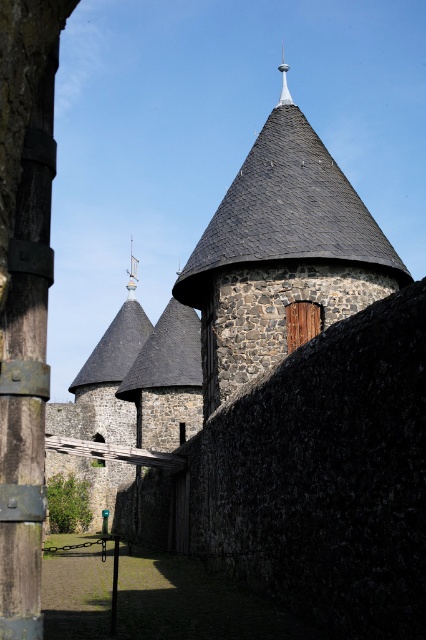
Question: From the image, what is the correct spatial relationship of dark gray stone tower at center in relation to silver metallic spire at upper center?

Choices:
 (A) left
 (B) right

Answer: (A)

Question: Observing the image, what is the correct spatial positioning of silver metallic spire at upper center in reference to shiny silver spire at center?

Choices:
 (A) right
 (B) left

Answer: (A)

Question: Which object appears farthest from the camera in this image?

Choices:
 (A) shiny silver spire at center
 (B) dark gray stone tower at center
 (C) silver metallic spire at upper center

Answer: (A)

Question: Does dark gray stone tower at center have a lesser width compared to silver metallic spire at upper center?

Choices:
 (A) yes
 (B) no

Answer: (A)

Question: Which of the following is the farthest from the observer?

Choices:
 (A) (307, 269)
 (B) (132, 262)

Answer: (B)

Question: Which object is closer to the camera taking this photo?

Choices:
 (A) dark gray stone tower at center
 (B) silver metallic spire at upper center

Answer: (A)